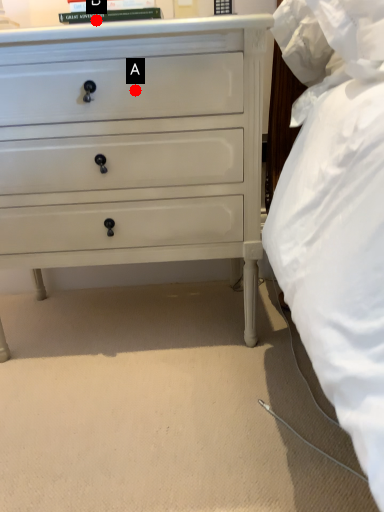
Question: Two points are circled on the image, labeled by A and B beside each circle. Which point is farther from the camera taking this photo?

Choices:
 (A) A is further
 (B) B is further

Answer: (A)